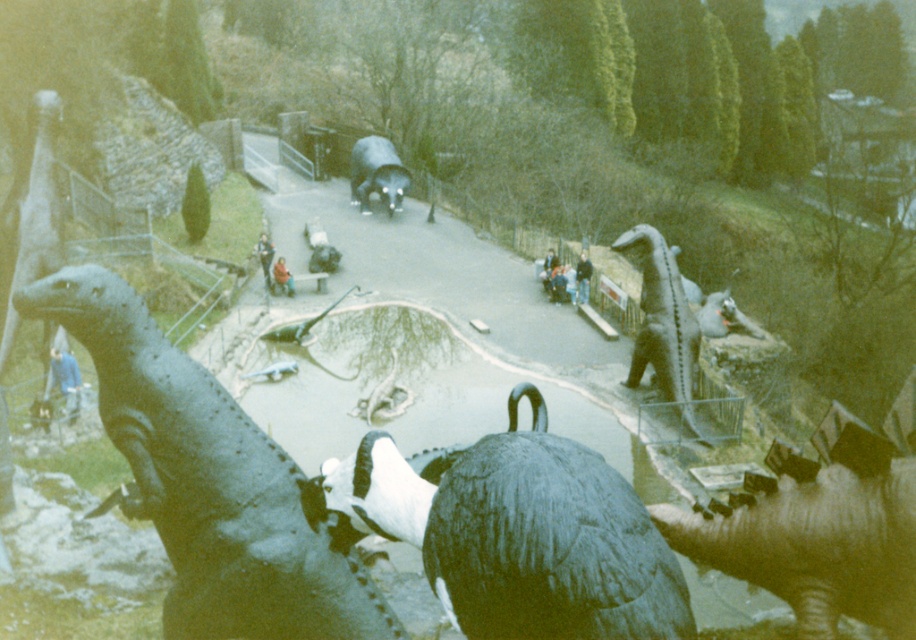
Does shiny metallic dinosaur at left appear under shiny metallic tank at center?

Indeed, shiny metallic dinosaur at left is positioned under shiny metallic tank at center.

Image resolution: width=916 pixels, height=640 pixels. Describe the element at coordinates (208, 481) in the screenshot. I see `shiny metallic dinosaur at left` at that location.

Find the location of a particular element. shiny metallic dinosaur at left is located at coordinates [x=208, y=481].

Is point (582, 476) positioned after point (55, 362)?

No, it is in front of (55, 362).

Who is shorter, black matte turtle at center or blue fabric person at lower left?

black matte turtle at center is shorter.

At what (x,y) coordinates should I click in order to perform the action: click on black matte turtle at center. Please return your answer as a coordinate pair (x, y). The image size is (916, 640). Looking at the image, I should click on (520, 534).

Is shiny metallic tank at center closer to camera compared to blue fabric person at lower left?

No, it is not.

Which is more to the left, shiny metallic tank at center or blue fabric person at lower left?

blue fabric person at lower left is more to the left.

Find the location of a particular element. shiny metallic tank at center is located at coordinates (377, 173).